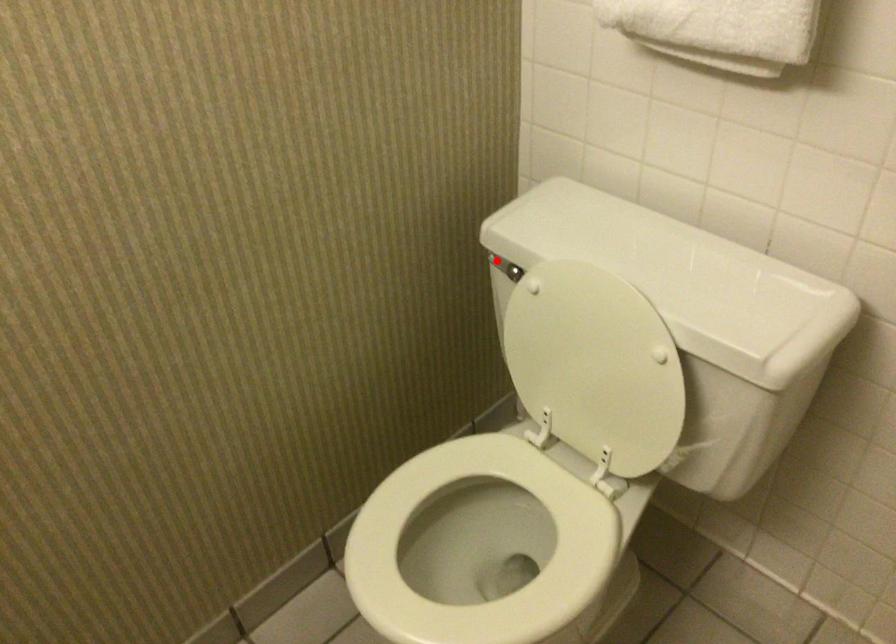
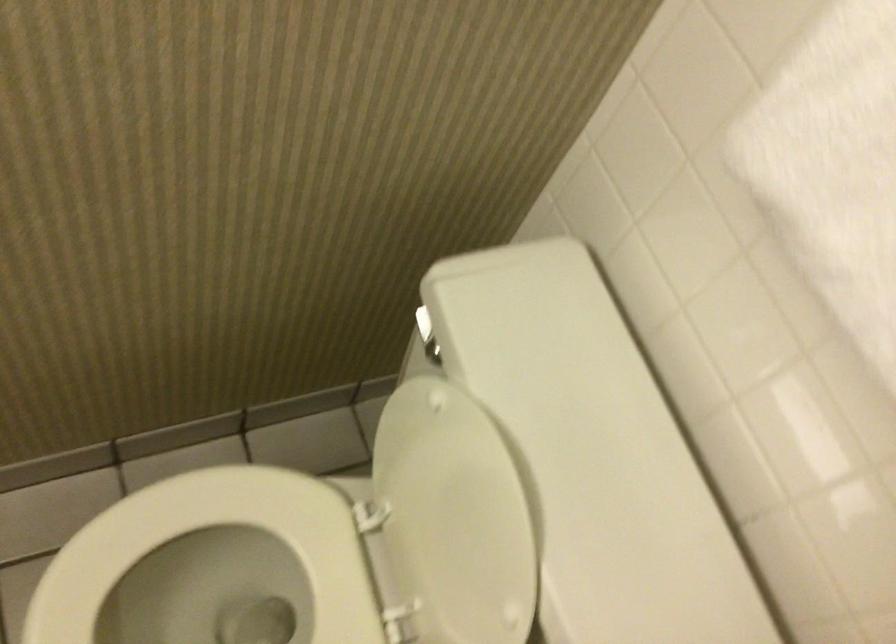
Question: I am providing you with two images of the same scene from different viewpoints. A red point is marked on the first image. Can you still see the location of the red point in image 2?

Choices:
 (A) Yes
 (B) No

Answer: (A)